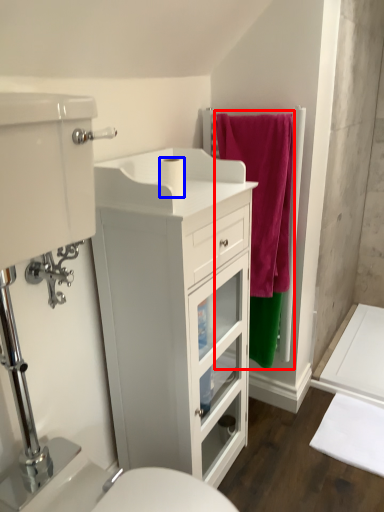
Question: Which of the following is the closest to the observer, bath towel (highlighted by a red box) or toilet paper (highlighted by a blue box)?

Choices:
 (A) bath towel
 (B) toilet paper

Answer: (B)